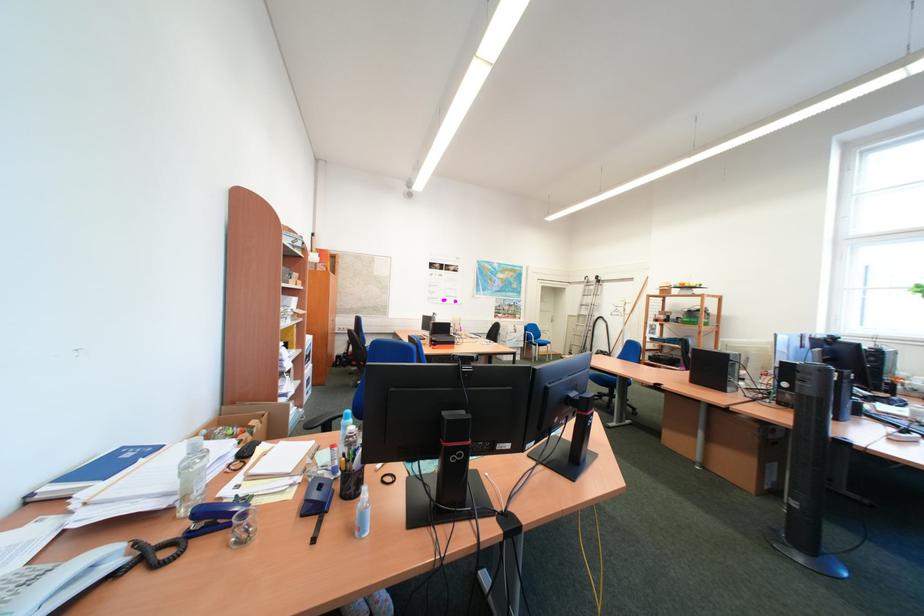
The image size is (924, 616). Describe the element at coordinates (546, 318) in the screenshot. I see `a white door handle` at that location.